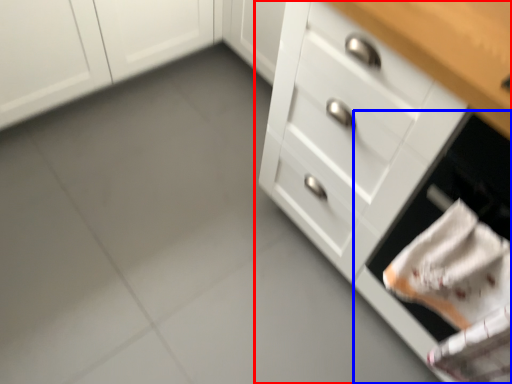
Question: Which of the following is the farthest to the observer, chest of drawers (highlighted by a red box) or oven (highlighted by a blue box)?

Choices:
 (A) chest of drawers
 (B) oven

Answer: (A)